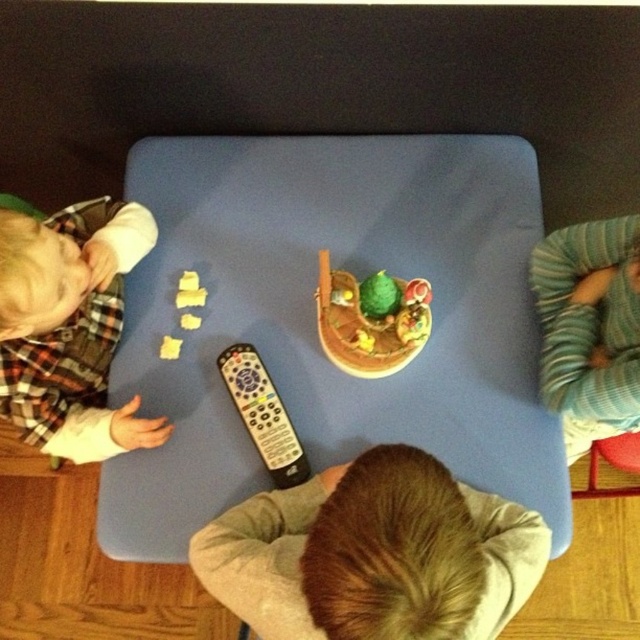
Question: Is blue fabric table at center wider than flannel shirt at left?

Choices:
 (A) no
 (B) yes

Answer: (B)

Question: Does blonde hair at center appear on the left side of black plastic remote at center?

Choices:
 (A) yes
 (B) no

Answer: (B)

Question: Is blue fabric table at center smaller than green striped sweater at right?

Choices:
 (A) no
 (B) yes

Answer: (A)

Question: Which object is closer to the camera taking this photo?

Choices:
 (A) smooth wooden bowl at center
 (B) blonde hair at center
 (C) flannel shirt at left
 (D) green striped sweater at right

Answer: (B)

Question: Which point is farther to the camera?

Choices:
 (A) blonde hair at center
 (B) black plastic remote at center

Answer: (B)

Question: Which object is the closest to the black plastic remote at center?

Choices:
 (A) blonde hair at center
 (B) smooth wooden bowl at center

Answer: (B)